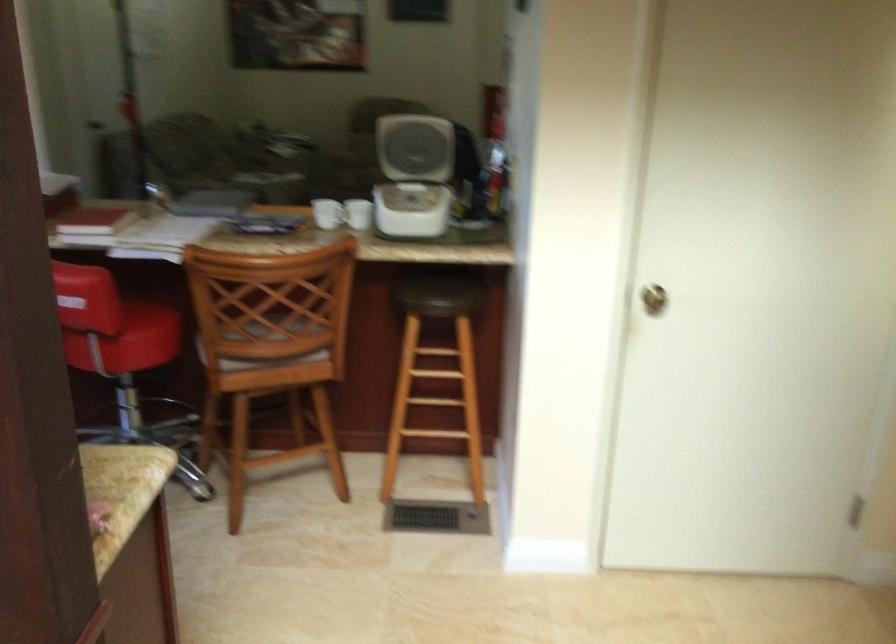
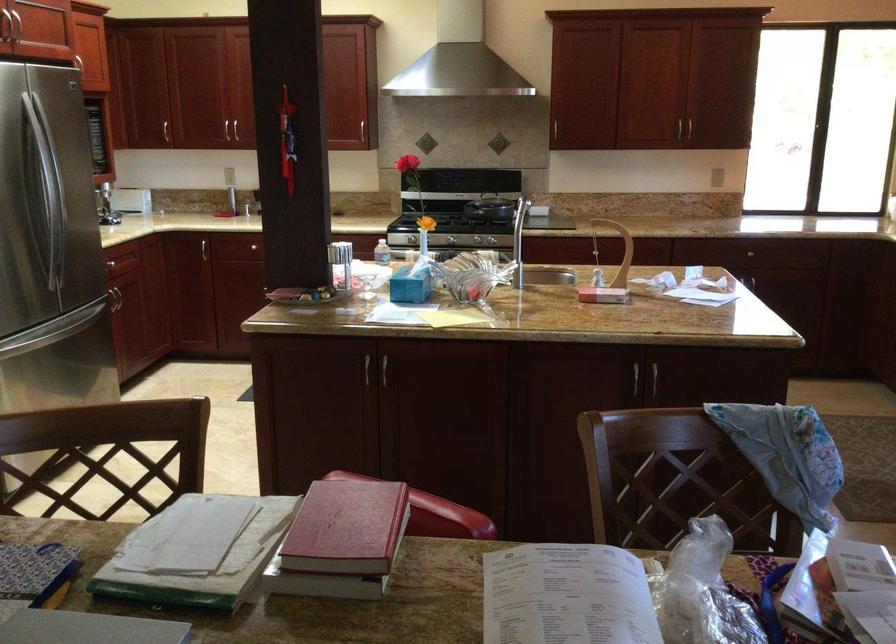
In the second image, find the point that corresponds to [93,210] in the first image.

(346, 527)